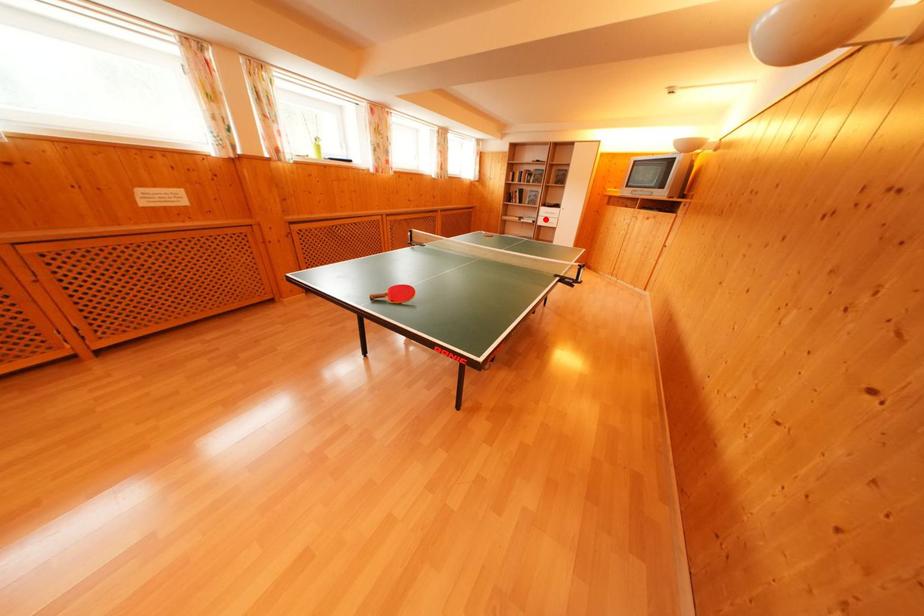
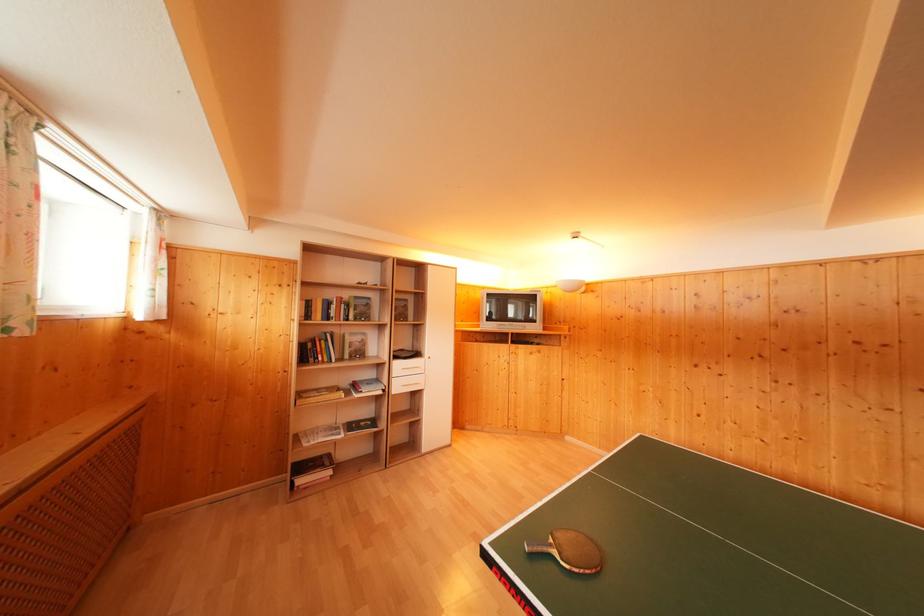
The point at the highlighted location is marked in the first image. Where is the corresponding point in the second image?

(398, 379)